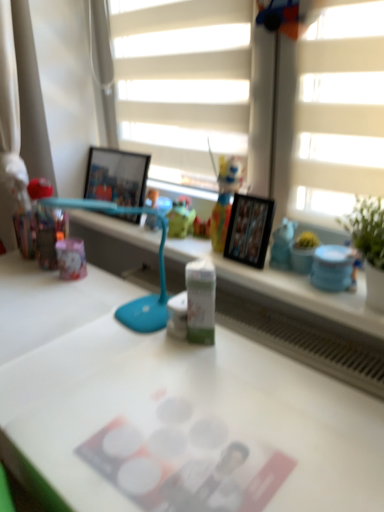
Question: From the image's perspective, relative to white matte blind at upper center, is green matte milk carton at center, placed as the 2th stationery when sorted from right to left, above or below?

Choices:
 (A) above
 (B) below

Answer: (B)

Question: Is point (210, 293) closer or farther from the camera than point (160, 172)?

Choices:
 (A) farther
 (B) closer

Answer: (B)

Question: Estimate the real-world distances between objects in this image. Which object is farther from the white matte desk at center?

Choices:
 (A) white matte blind at upper center
 (B) wooden photo frame at upper center, the first picture frame from the back
 (C) wooden photo frame at center, the 2th picture frame viewed from the back
 (D) teal plastic table lamp at center
 (E) blue glossy jar at upper right, the first stationery in the right-to-left sequence

Answer: (A)

Question: Estimate the real-world distances between objects in this image. Which object is farther from the green matte milk carton at center, the 1th stationery when ordered from left to right?

Choices:
 (A) wooden photo frame at center, which is counted as the 2th picture frame, starting from the top
 (B) white matte blind at upper center
 (C) blue glossy jar at upper right, the first stationery in the right-to-left sequence
 (D) teal plastic table lamp at center
 (E) translucent plastic toy at center

Answer: (B)